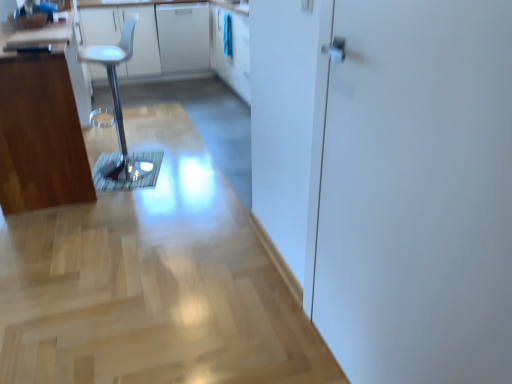
Find the location of a particular element. This screenshot has height=384, width=512. vacant space to the right of wooden cabinet at left, which is the first cabinetry from front to back is located at coordinates 188,164.